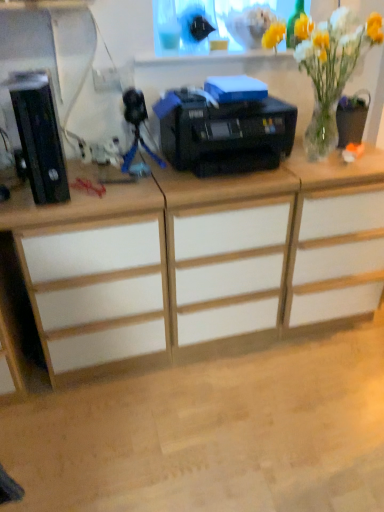
Identify the location of blank space situated above white matte desk at left (from a real-world perspective). (71, 179).